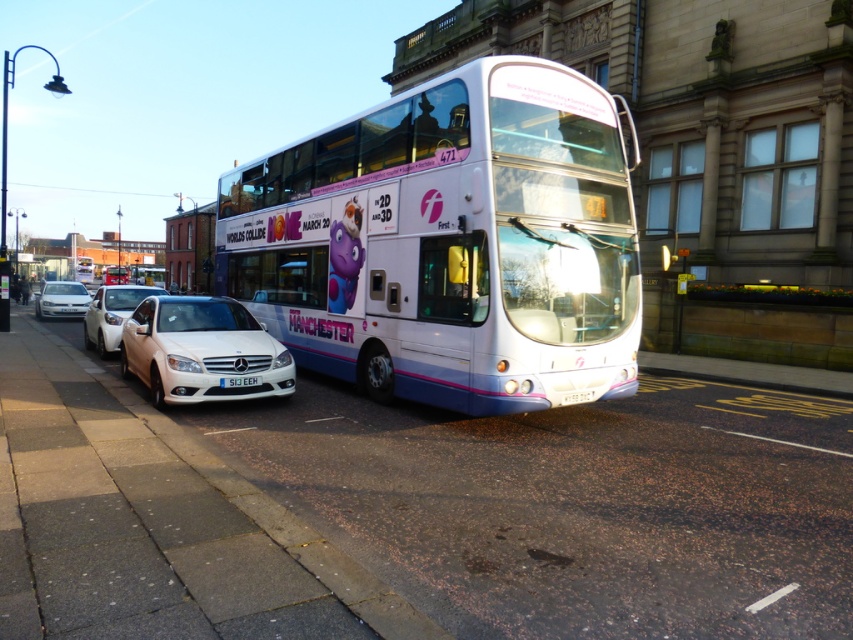
Question: Among these points, which one is farthest from the camera?

Choices:
 (A) (70, 305)
 (B) (228, 378)
 (C) (233, 308)
 (D) (415, 240)

Answer: (A)

Question: Among these points, which one is farthest from the camera?

Choices:
 (A) (624, 195)
 (B) (119, 289)
 (C) (242, 384)
 (D) (245, 337)

Answer: (B)

Question: Can you confirm if white glossy bus at center is smaller than white glossy sedan at center?

Choices:
 (A) no
 (B) yes

Answer: (A)

Question: Does white glossy bus at center appear under white plastic license plate at center?

Choices:
 (A) no
 (B) yes

Answer: (A)

Question: Is white glossy sedan at center bigger than white glossy sedan at left?

Choices:
 (A) yes
 (B) no

Answer: (B)

Question: Which of the following is the closest to the observer?

Choices:
 (A) white glossy sedan at center
 (B) white glossy bus at center
 (C) white plastic license plate at center

Answer: (B)